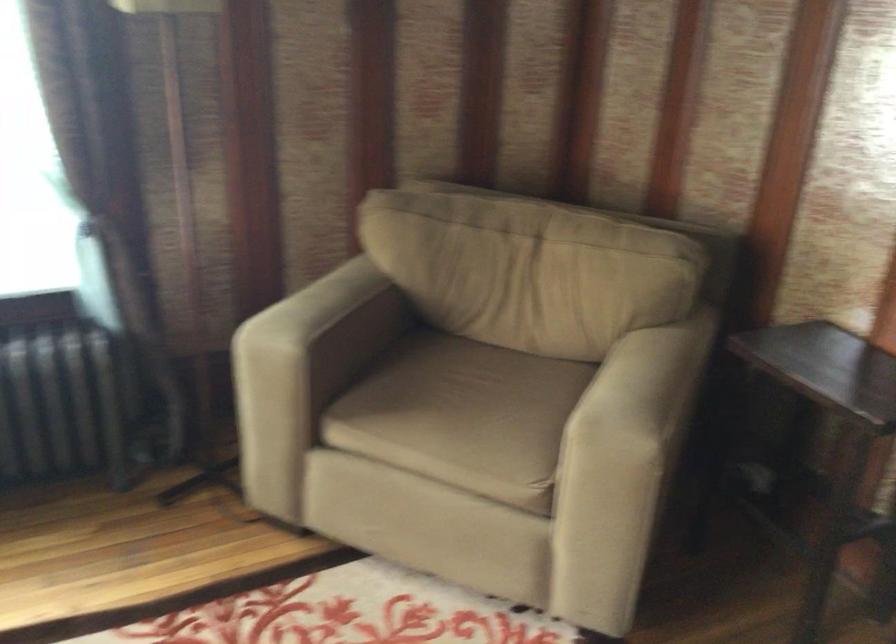
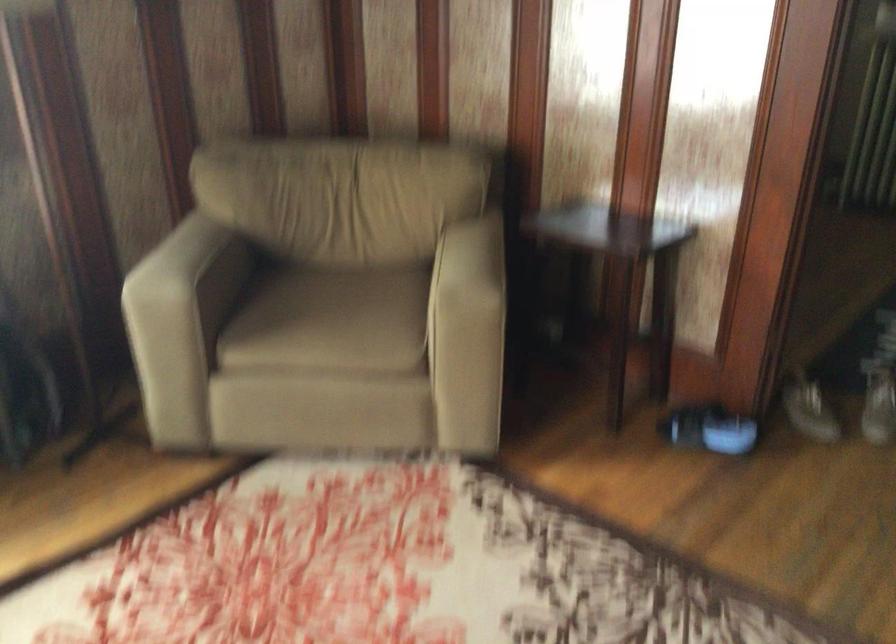
The point at (328,297) is marked in the first image. Where is the corresponding point in the second image?

(194, 245)